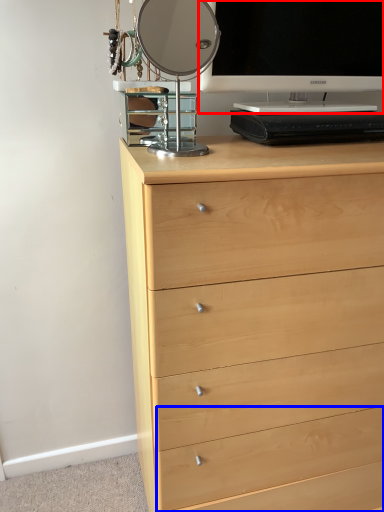
Question: Which of the following is the farthest to the observer, television (highlighted by a red box) or drawer (highlighted by a blue box)?

Choices:
 (A) television
 (B) drawer

Answer: (B)